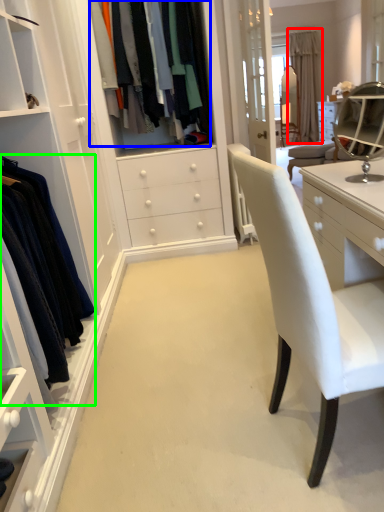
Question: Which object is positioned closest to curtain (highlighted by a red box)? Select from clothing (highlighted by a blue box) and clothing (highlighted by a green box).

Choices:
 (A) clothing
 (B) clothing

Answer: (A)